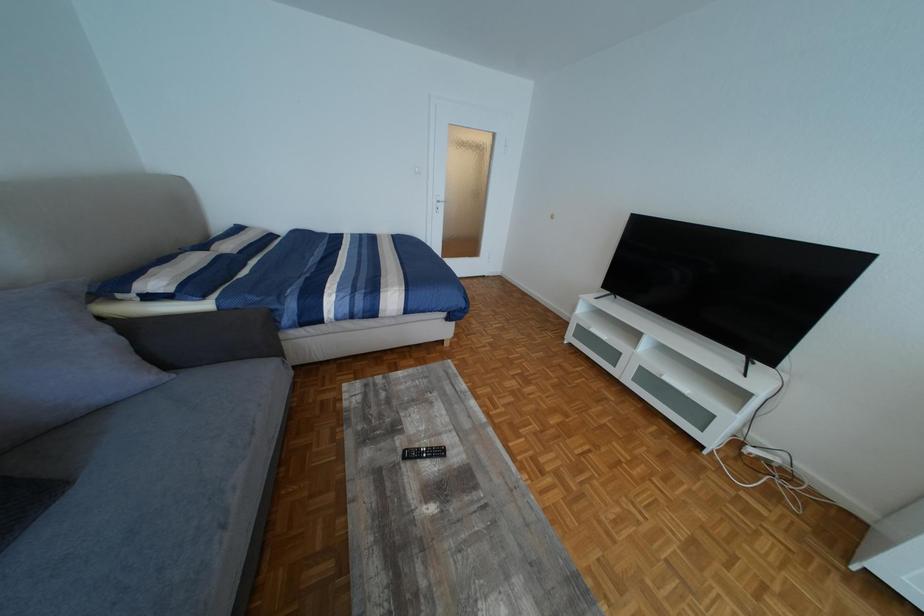
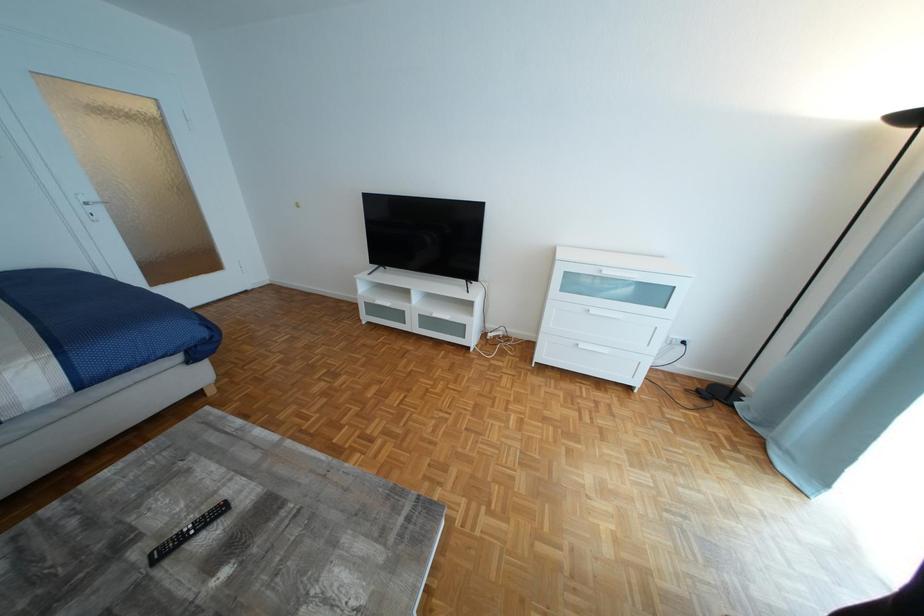
Question: The camera is either moving clockwise (left) or counter-clockwise (right) around the object. The first image is from the beginning of the video and the second image is from the end. Is the camera moving left or right when shooting the video?

Choices:
 (A) Left
 (B) Right

Answer: (A)